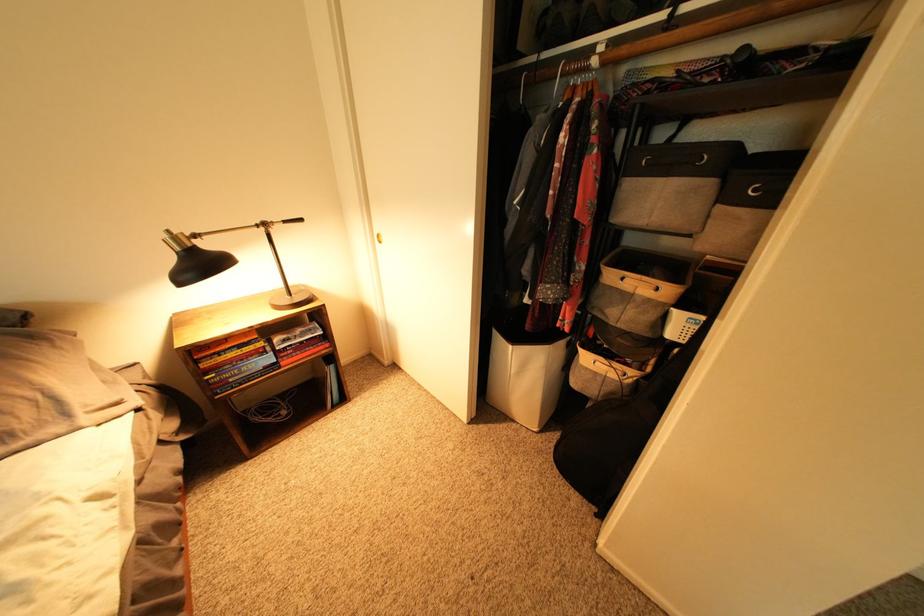
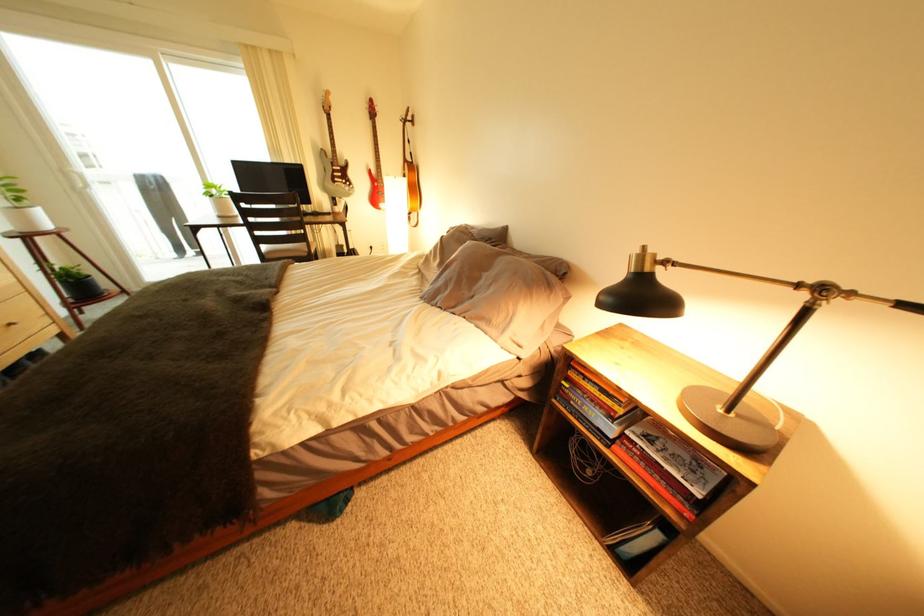
Find the pixel in the second image that matches the point at 277,225 in the first image.

(834, 291)